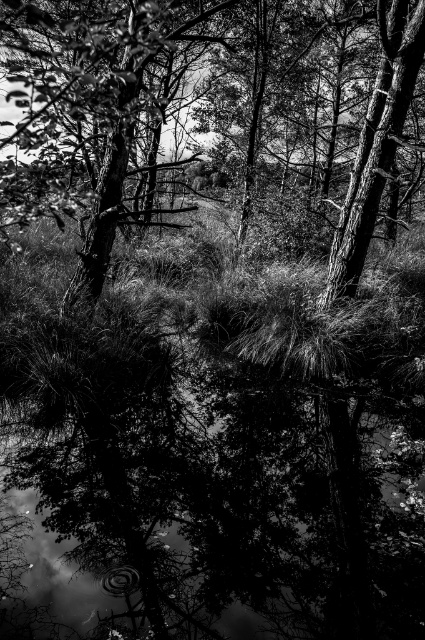
Is smooth bark tree at center shorter than smooth bark tree at upper right?

No, smooth bark tree at center is not shorter than smooth bark tree at upper right.

Is smooth bark tree at center to the left of smooth bark tree at upper right from the viewer's perspective?

Indeed, smooth bark tree at center is positioned on the left side of smooth bark tree at upper right.

I want to click on smooth bark tree at center, so click(99, 99).

Locate an element on the screen. The width and height of the screenshot is (425, 640). smooth bark tree at center is located at coordinates (99, 99).

Is point (204, 634) in front of point (116, 144)?

Yes, it is.

Is point (354, 554) in front of point (93, 93)?

No, (354, 554) is further to viewer.

This screenshot has height=640, width=425. I want to click on transparent water at center, so tap(207, 492).

Where is `transparent water at center`? Image resolution: width=425 pixels, height=640 pixels. transparent water at center is located at coordinates (207, 492).

Which is in front, point (405, 628) or point (342, 244)?

Point (405, 628) is in front.

Who is more distant from viewer, [158,547] or [357,188]?

Point [357,188]

The width and height of the screenshot is (425, 640). In order to click on transparent water at center in this screenshot , I will do `click(207, 492)`.